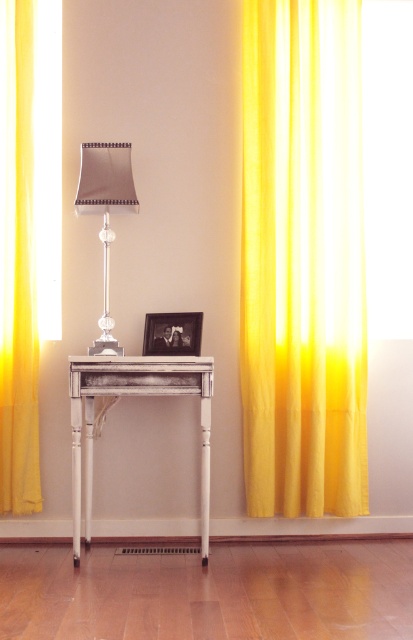
You are standing in the room and want to see the view outside through the window. Which curtain should you move aside to have an unobstructed view? The yellow sheer curtain at left or the translucent yellow curtain at right?

The yellow sheer curtain at left is in front of the translucent yellow curtain at right. To have an unobstructed view, you should move aside the yellow sheer curtain at left first, then the translucent yellow curtain at right. However, since the translucent yellow curtain at right is behind, moving only the translucent yellow curtain at right might still leave the yellow sheer curtain at left blocking the view. Therefore, you must move the yellow sheer curtain at left to see through.

Looking at this image, you are standing in front of the table and want to place a new decorative item. If you want to place it behind the existing items on the table, which coordinate should you choose between point (273,132) and point (75,451)?

You should choose point (273,132) because it is behind point (75,451) according to the spatial arrangement.

You are planning to hang a new set of curtains in your living room. You have two options from the image provided. The first is the yellow sheer curtain at left, and the second is the translucent yellow curtain at right. Which curtain would you choose if you want one that reaches closer to the floor?

The yellow sheer curtain at left is much taller than the translucent yellow curtain at right, so it would reach closer to the floor.